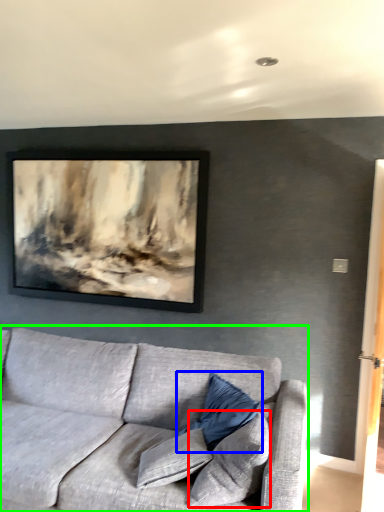
Question: Based on their relative distances, which object is nearer to pillow (highlighted by a red box)? Choose from pillow (highlighted by a blue box) and studio couch (highlighted by a green box).

Choices:
 (A) pillow
 (B) studio couch

Answer: (A)